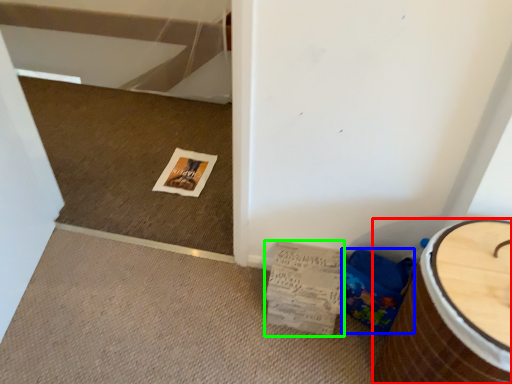
Question: Based on their relative distances, which object is farther from furniture (highlighted by a red box)? Choose from potty (highlighted by a blue box) and magazine (highlighted by a green box).

Choices:
 (A) potty
 (B) magazine

Answer: (B)